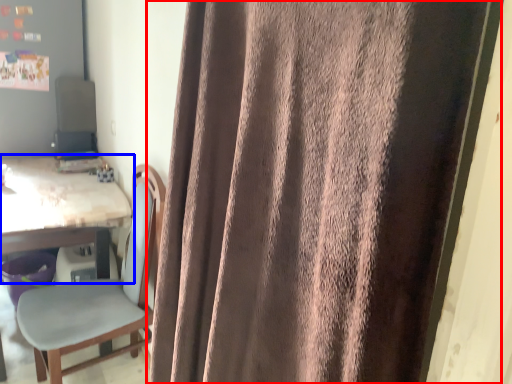
Question: Among these objects, which one is farthest to the camera, curtain (highlighted by a red box) or table (highlighted by a blue box)?

Choices:
 (A) curtain
 (B) table

Answer: (B)